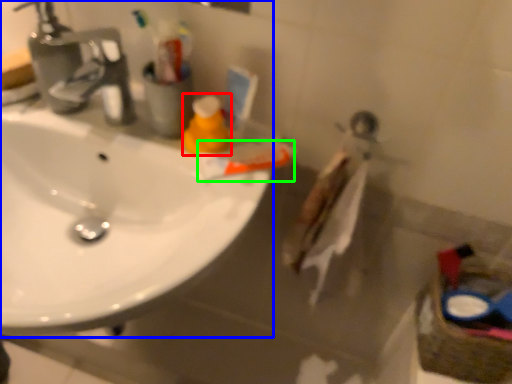
Question: Which object is the farthest from cleaning product (highlighted by a red box)? Choose among these: sink (highlighted by a blue box) or toothpaste (highlighted by a green box).

Choices:
 (A) sink
 (B) toothpaste

Answer: (A)